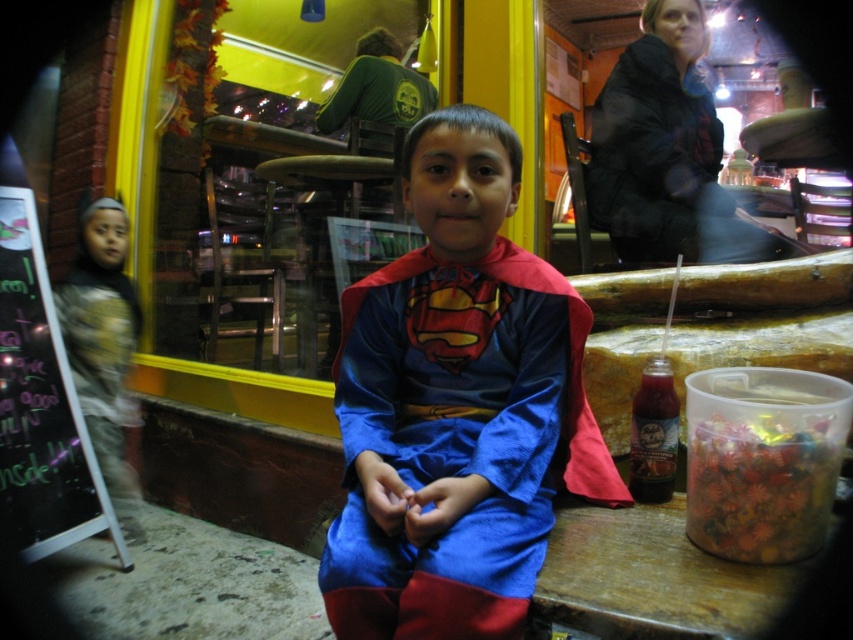
Does velvet blue cape at center appear over black fuzzy robe at upper right?

No, velvet blue cape at center is not above black fuzzy robe at upper right.

Which is more to the left, velvet blue cape at center or black fuzzy robe at upper right?

From the viewer's perspective, velvet blue cape at center appears more on the left side.

Which is behind, point (381, 422) or point (695, 109)?

The point (695, 109) is more distant.

Find the location of `velvet blue cape at center`. velvet blue cape at center is located at coordinates (456, 404).

Which is behind, point (671, 232) or point (596, 529)?

The point (671, 232) is more distant.

Is point (596, 196) less distant than point (645, 573)?

That is False.

You are a GUI agent. You are given a task and a screenshot of the screen. Output one action in this format:
    pyautogui.click(x=<x>, y=<y>)
    Task: Click on the black fuzzy robe at upper right
    This screenshot has width=853, height=640.
    Given the screenshot: What is the action you would take?
    pyautogui.click(x=665, y=163)

The width and height of the screenshot is (853, 640). I want to click on black fuzzy robe at upper right, so click(x=665, y=163).

Which is more to the left, black fuzzy robe at upper right or translucent plastic container at lower right?

translucent plastic container at lower right

Looking at this image, can you confirm if black fuzzy robe at upper right is thinner than translucent plastic container at lower right?

No, black fuzzy robe at upper right is not thinner than translucent plastic container at lower right.

Which is behind, point (688, 221) or point (695, 499)?

The point (688, 221) is behind.

What are the coordinates of `black fuzzy robe at upper right` in the screenshot? It's located at (665, 163).